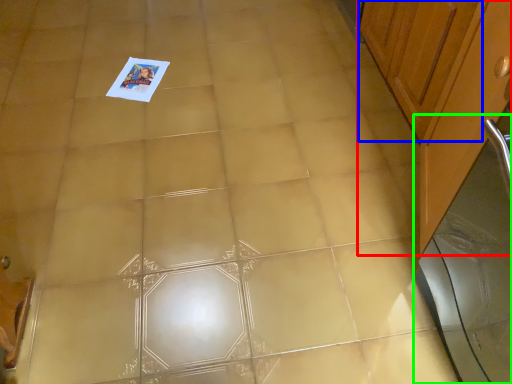
Question: Estimate the real-world distances between objects in this image. Which object is closer to cabinetry (highlighted by a red box), cabinetry (highlighted by a blue box) or screen door (highlighted by a green box)?

Choices:
 (A) cabinetry
 (B) screen door

Answer: (A)